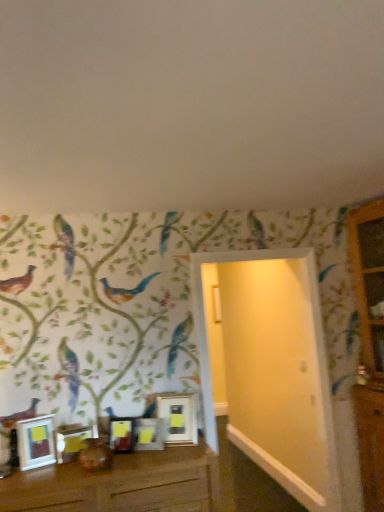
You are a GUI agent. You are given a task and a screenshot of the screen. Output one action in this format:
    pyautogui.click(x=<x>, y=<y>)
    Task: Click on the free space to the left of matte brown vase at center
    
    Given the screenshot: What is the action you would take?
    pyautogui.click(x=62, y=473)